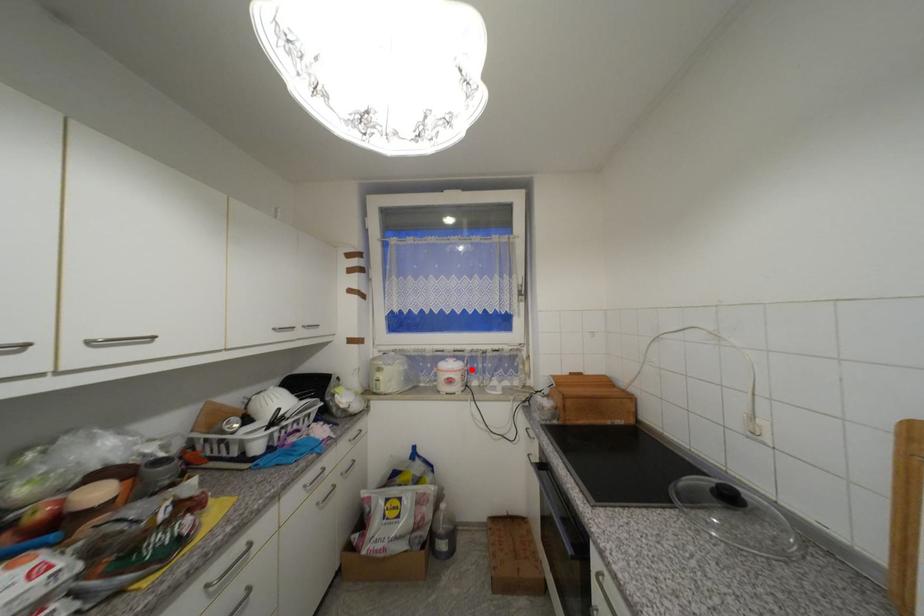
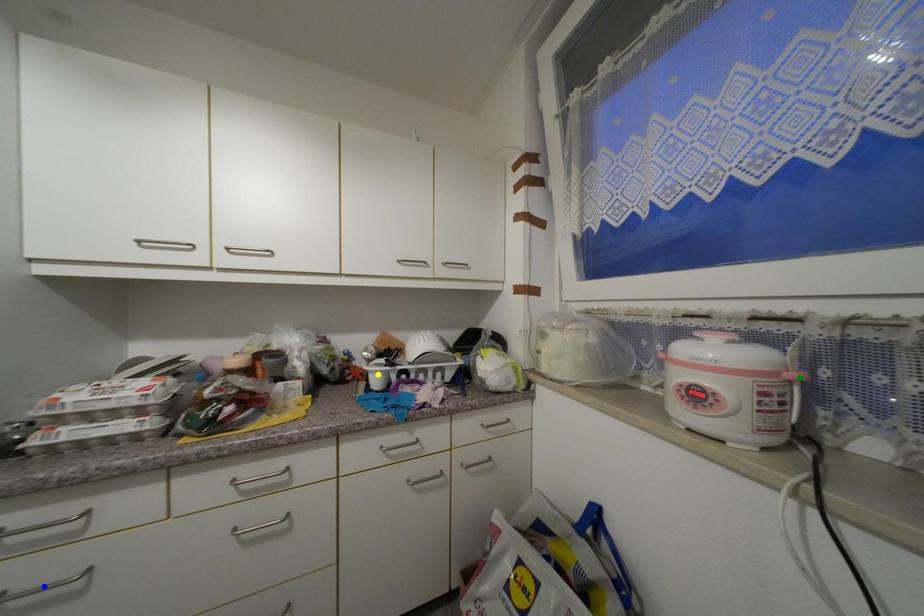
Question: I am providing you with two images of the same scene from different viewpoints. A red point is marked on the first image. You are given multiple points on the second image. Which mark in image 2 goes with the point in image 1?

Choices:
 (A) blue point
 (B) yellow point
 (C) green point

Answer: (C)